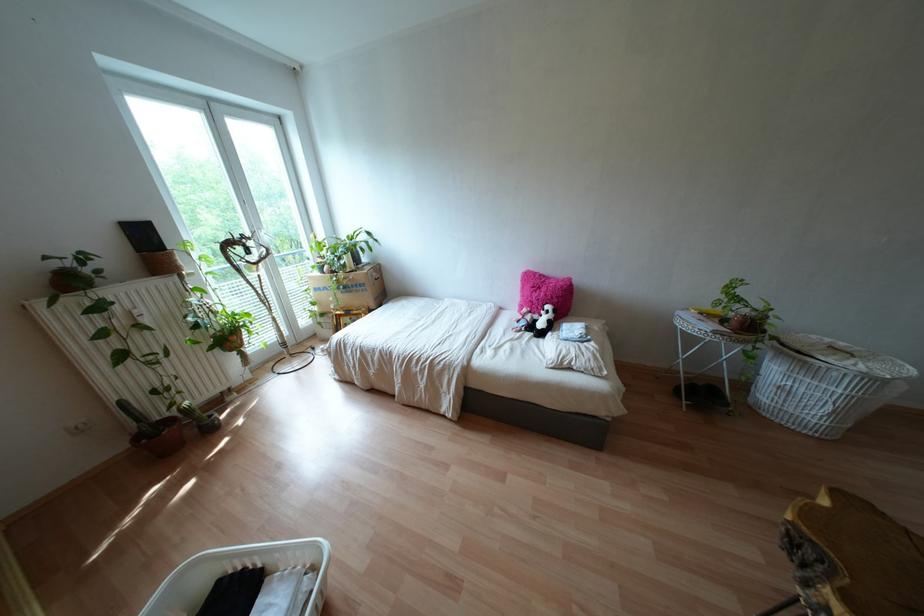
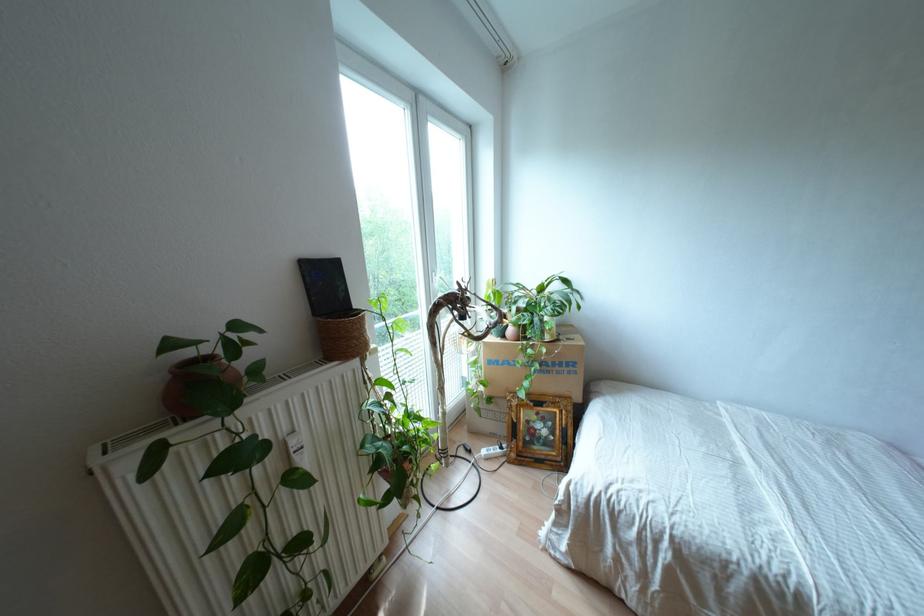
Find the pixel in the second image that matches (x=148, y=224) in the first image.

(334, 262)